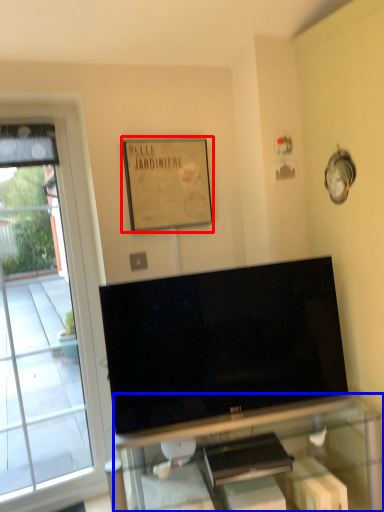
Question: Which point is further to the camera, picture frame (highlighted by a red box) or furniture (highlighted by a blue box)?

Choices:
 (A) picture frame
 (B) furniture

Answer: (A)